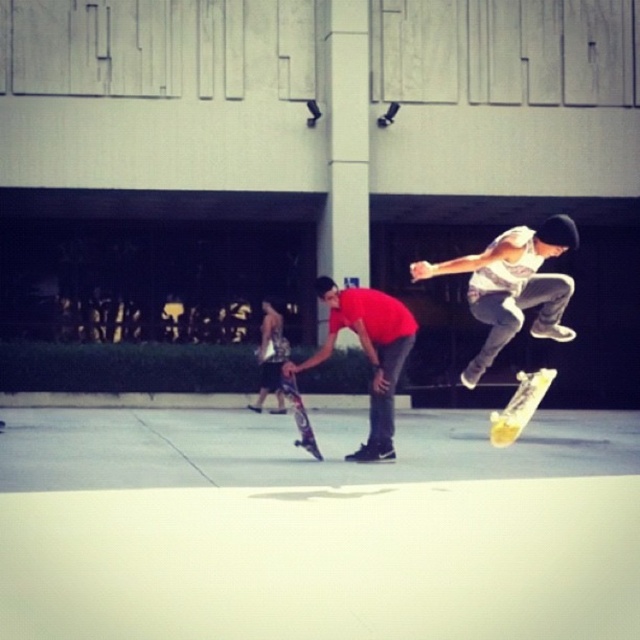
Does white cotton tank top at upper right appear over matte red shirt at center?

Indeed, white cotton tank top at upper right is positioned over matte red shirt at center.

How far apart are white cotton tank top at upper right and matte red shirt at center?

They are 1.34 meters apart.

Does point (451, 269) lie behind point (385, 380)?

No.

At what (x,y) coordinates should I click in order to perform the action: click on white cotton tank top at upper right. Please return your answer as a coordinate pair (x, y). Looking at the image, I should click on (513, 285).

Is point (529, 396) closer to viewer compared to point (292, 406)?

Yes, point (529, 396) is closer to viewer.

Does yellow wooden skateboard at center have a larger size compared to shiny purple skateboard at center?

Yes.

This screenshot has height=640, width=640. Find the location of `yellow wooden skateboard at center`. yellow wooden skateboard at center is located at coordinates pos(518,406).

Identify the location of yellow wooden skateboard at center. The width and height of the screenshot is (640, 640). (518, 406).

Is the position of matte red shirt at center more distant than that of shiny purple skateboard at center?

That is False.

Which is behind, point (352, 312) or point (307, 436)?

The point (307, 436) is behind.

Which is in front, point (371, 321) or point (310, 435)?

Point (371, 321)

I want to click on matte red shirt at center, so click(x=369, y=353).